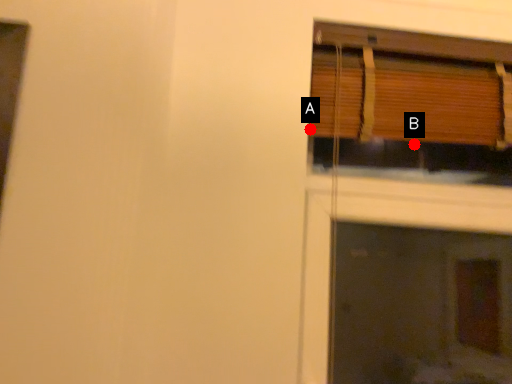
Question: Two points are circled on the image, labeled by A and B beside each circle. Which point appears closest to the camera in this image?

Choices:
 (A) A is closer
 (B) B is closer

Answer: (A)